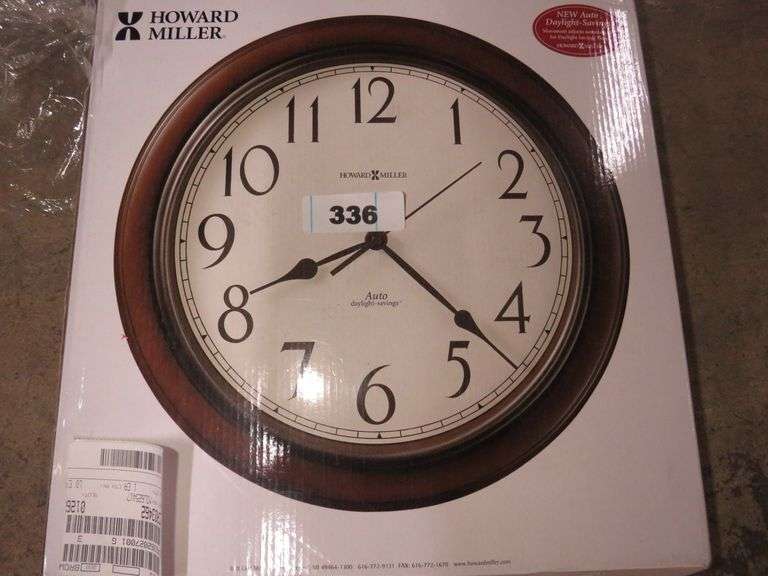
Identify the location of clock frame. The height and width of the screenshot is (576, 768). (564, 140).